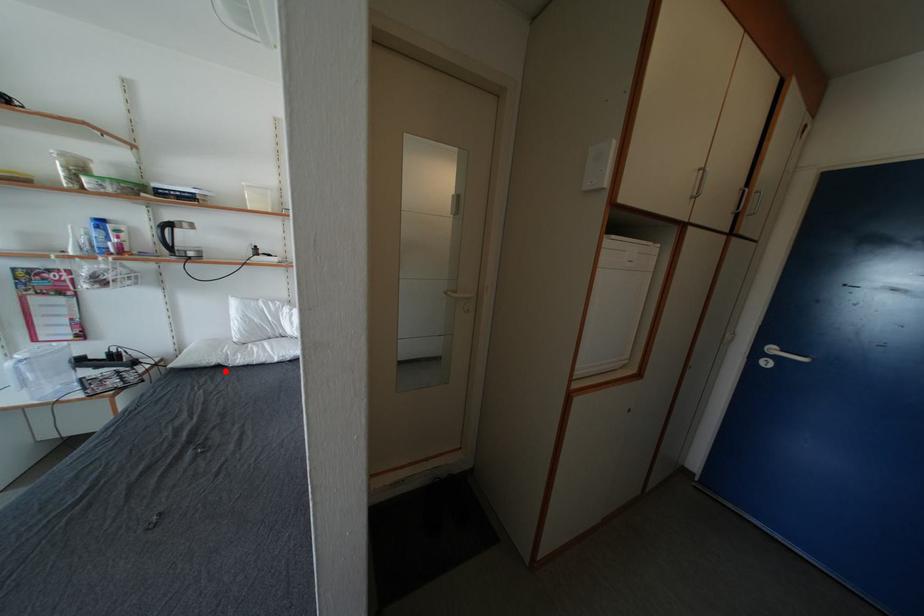
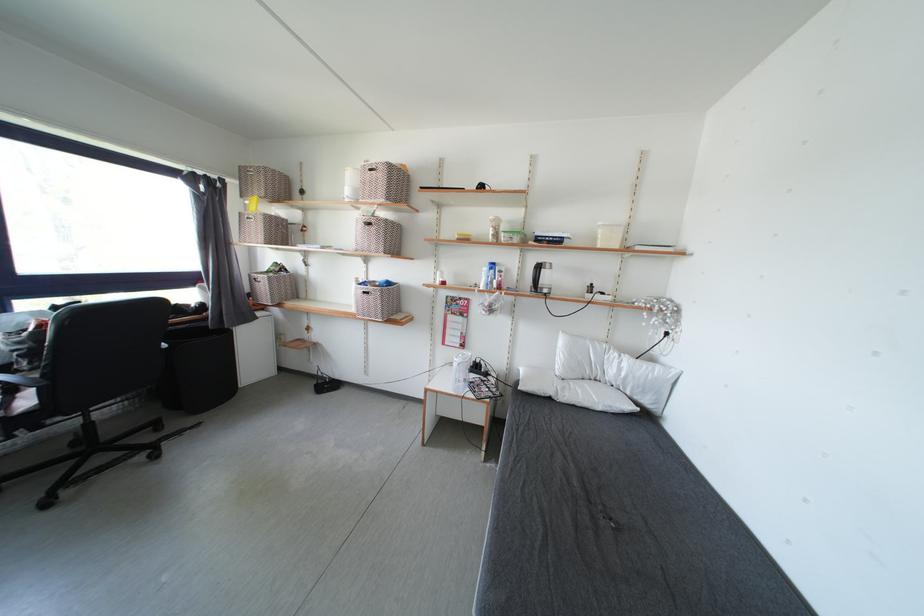
Find the pixel in the second image that matches the highlighted location in the first image.

(556, 403)